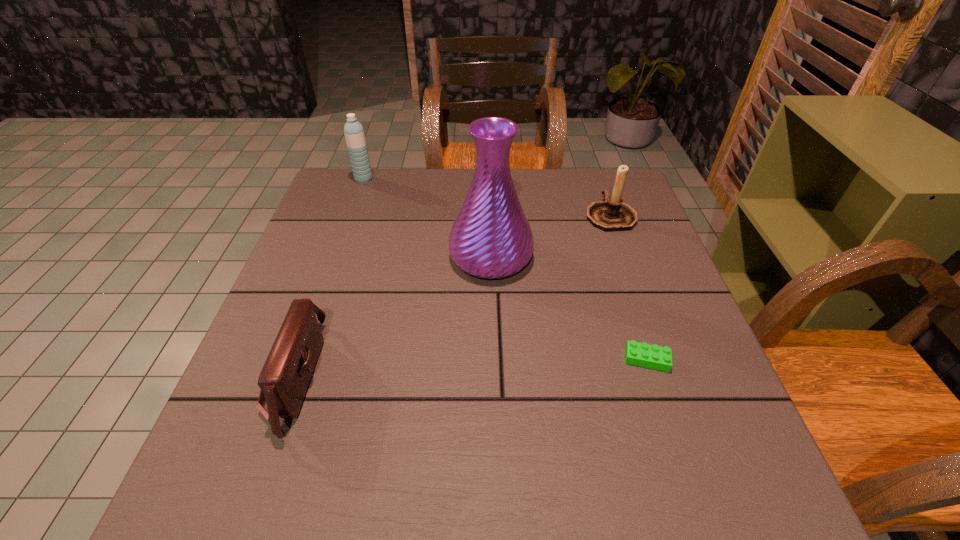
In the image, there is a desktop. Where is `free region at the far edge`? The height and width of the screenshot is (540, 960). free region at the far edge is located at coordinates (418, 182).

Image resolution: width=960 pixels, height=540 pixels. In the image, there is a desktop. What are the coordinates of `free space at the near edge` in the screenshot? It's located at (291, 508).

At what (x,y) coordinates should I click in order to perform the action: click on blank space at the left edge of the desktop. Please return your answer as a coordinate pair (x, y). Image resolution: width=960 pixels, height=540 pixels. Looking at the image, I should click on (250, 357).

The width and height of the screenshot is (960, 540). I want to click on blank area at the right edge, so click(x=668, y=455).

Where is `blank space at the far left corner of the desktop`? blank space at the far left corner of the desktop is located at coordinates (372, 213).

The width and height of the screenshot is (960, 540). Identify the location of free location at the near left corner. (221, 490).

Where is `free point at the far right corner`? The image size is (960, 540). free point at the far right corner is located at coordinates (590, 193).

Locate an element on the screen. vacant space at the near right corner of the desktop is located at coordinates (681, 514).

The height and width of the screenshot is (540, 960). What are the coordinates of `unoccupied position between the tallest object and the second shortest object` in the screenshot? It's located at (393, 317).

Locate an element on the screen. This screenshot has height=540, width=960. free space between the shoulder bag and the farthest object is located at coordinates point(329,279).